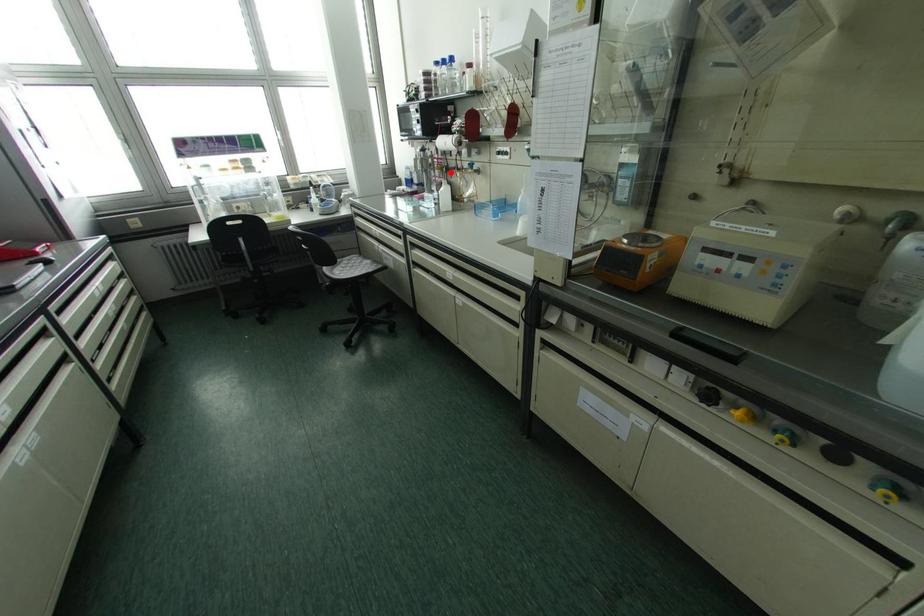
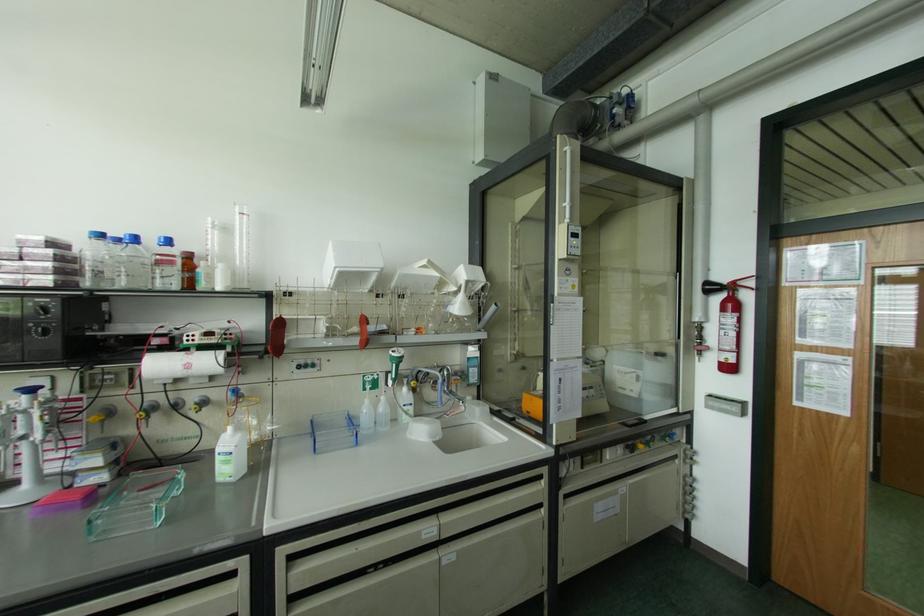
The point at the highlighted location is marked in the first image. Where is the corresponding point in the second image?

(148, 416)